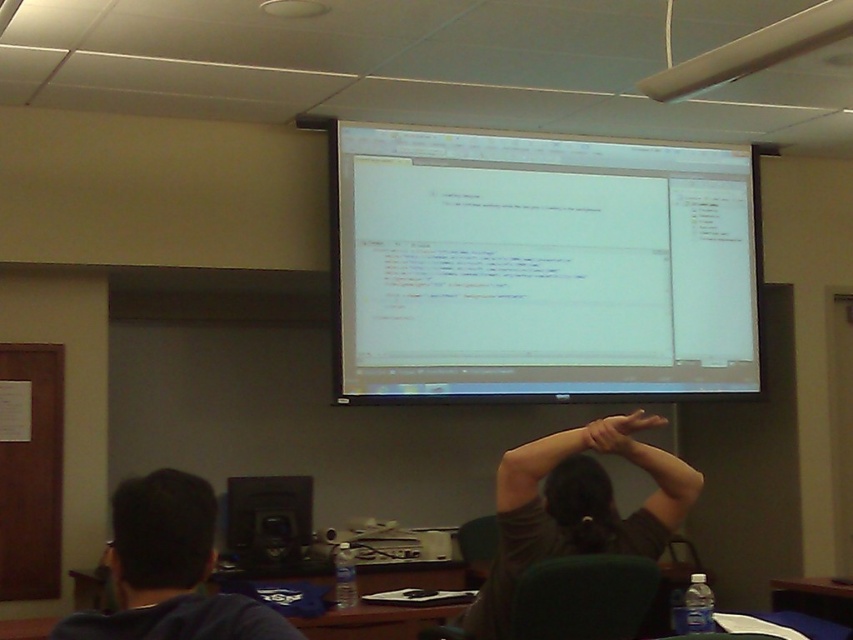
You are standing at the center of the classroom and want to reach the dark brown shirt at upper center. Based on its coordinates, in which direction should you move? Please specify the direction as either north, south, east, or west.

The dark brown shirt at upper center is located at coordinates point (x=576, y=508). Since the coordinate system is not specified, it is impossible to determine the exact direction to move. However, in standard image coordinate systems, the upper center would generally correspond to a position towards the north direction. Therefore, you should move north to reach the dark brown shirt at upper center.

You are a student sitting at the back of the classroom and want to read the text on the white glossy projection screen at upper center. However, there is a dark brown shirt at upper center blocking your view. Based on their sizes, do you think you can see the text on the screen?

The white glossy projection screen at upper center is much taller than the dark brown shirt at upper center, so you should be able to see the text on the screen above the dark brown shirt at upper center.

You are a student sitting in the classroom and want to read the text on the white glossy projection screen at upper center. However, there is a dark brown shirt at upper center in your line of sight. Can you see the text on the screen clearly?

The white glossy projection screen at upper center is located above the dark brown shirt at upper center, so the shirt is below the screen and might not block your view. You should be able to see the text on the screen clearly unless the shirt is moved upwards.